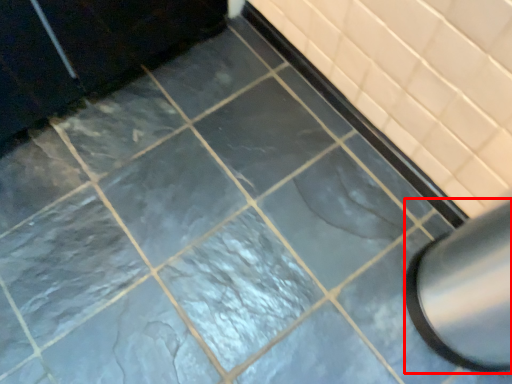
Question: Observing the image, what is the correct spatial positioning of exhaust hood (annotated by the red box) in reference to bath?

Choices:
 (A) right
 (B) left

Answer: (A)